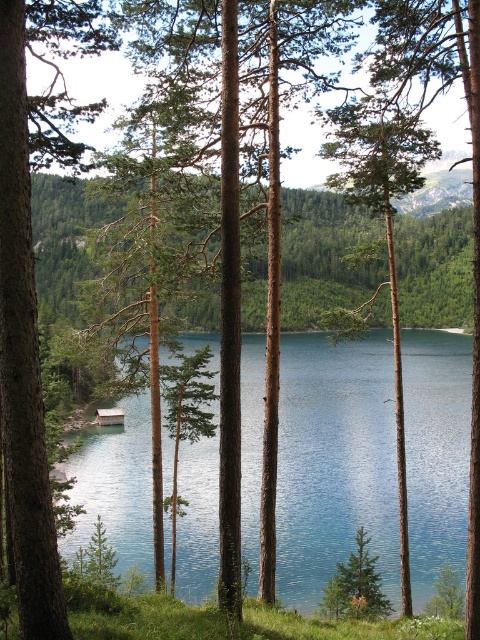
Is blue glassy water at center taller than green rough bark tree at center?

No.

The image size is (480, 640). What are the coordinates of `blue glassy water at center` in the screenshot? It's located at (335, 461).

Does point (445, 336) lie in front of point (381, 184)?

No, (445, 336) is further to viewer.

Where is `blue glassy water at center`? The width and height of the screenshot is (480, 640). blue glassy water at center is located at coordinates (335, 461).

Who is lower down, green matte pine forest at center or green rough bark tree at center?

green matte pine forest at center

Between point (443, 230) and point (403, 611), which one is positioned behind?

The point (443, 230) is more distant.

Is point (45, 257) positioned after point (384, 173)?

Yes.

What are the coordinates of `green matte pine forest at center` in the screenshot? It's located at (324, 256).

What do you see at coordinates (335, 461) in the screenshot? This screenshot has width=480, height=640. I see `blue glassy water at center` at bounding box center [335, 461].

Who is shorter, blue glassy water at center or green matte pine forest at center?

Standing shorter between the two is blue glassy water at center.

This screenshot has width=480, height=640. In order to click on blue glassy water at center in this screenshot , I will do `click(335, 461)`.